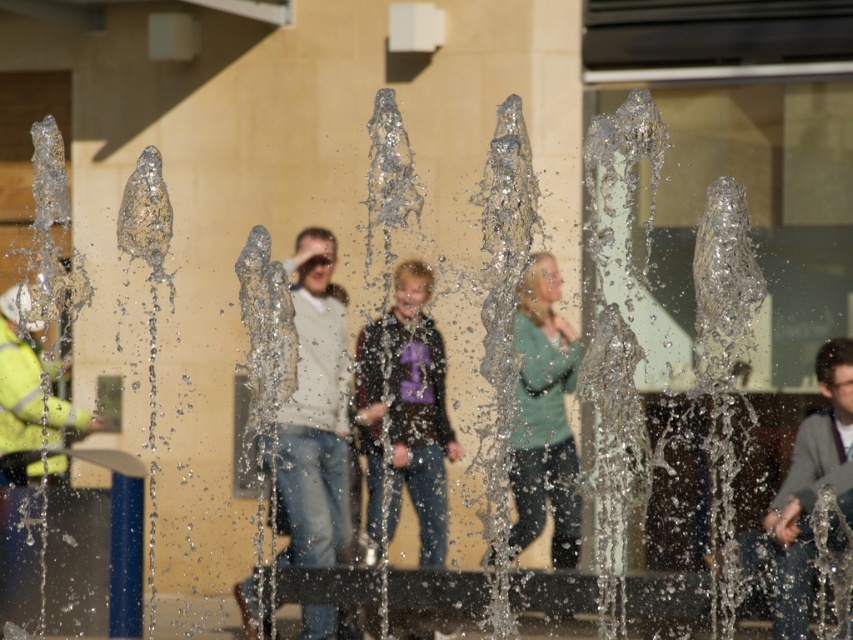
Does point (404, 404) come behind point (821, 420)?

Yes, point (404, 404) is farther from viewer.

Who is more forward, (410,416) or (811,470)?

Positioned in front is point (811,470).

Find the location of a particular element. Image resolution: width=853 pixels, height=640 pixels. dark purple fabric shirt at center is located at coordinates (405, 417).

Is point (283, 429) farther from viewer compared to point (28, 312)?

No, it is not.

Locate an element on the screen. Image resolution: width=853 pixels, height=640 pixels. matte white sweater at center is located at coordinates point(315,412).

Is teal matte sweater at center to the left of gray fabric jacket at lower right from the viewer's perspective?

Indeed, teal matte sweater at center is positioned on the left side of gray fabric jacket at lower right.

Can you confirm if teal matte sweater at center is positioned below gray fabric jacket at lower right?

No, teal matte sweater at center is not below gray fabric jacket at lower right.

Which is behind, point (548, 436) or point (776, 515)?

Positioned behind is point (548, 436).

Locate an element on the screen. Image resolution: width=853 pixels, height=640 pixels. teal matte sweater at center is located at coordinates (543, 417).